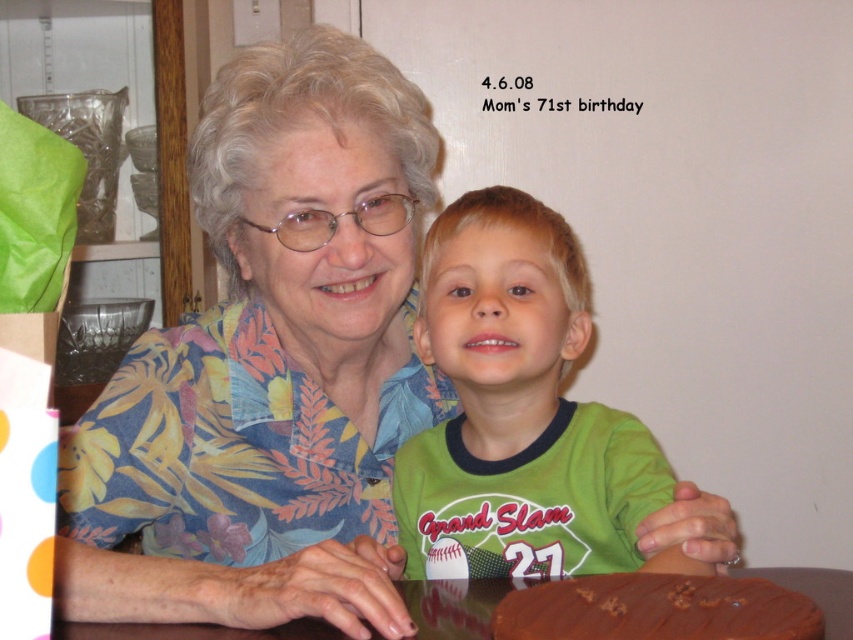
Question: Does chocolate matte cake at lower center lie in front of brown glossy table at lower center?

Choices:
 (A) yes
 (B) no

Answer: (A)

Question: Which object appears closest to the camera in this image?

Choices:
 (A) green jersey at center
 (B) brown glossy table at lower center
 (C) chocolate matte cake at lower center

Answer: (C)

Question: Is chocolate matte cake at lower center below brown glossy table at lower center?

Choices:
 (A) yes
 (B) no

Answer: (B)

Question: Among these objects, which one is farthest from the camera?

Choices:
 (A) chocolate matte cake at lower center
 (B) brown glossy table at lower center

Answer: (B)

Question: Is chocolate matte cake at lower center thinner than brown glossy table at lower center?

Choices:
 (A) no
 (B) yes

Answer: (B)

Question: Considering the real-world distances, which object is closest to the green jersey at center?

Choices:
 (A) chocolate matte cake at lower center
 (B) brown glossy table at lower center

Answer: (B)